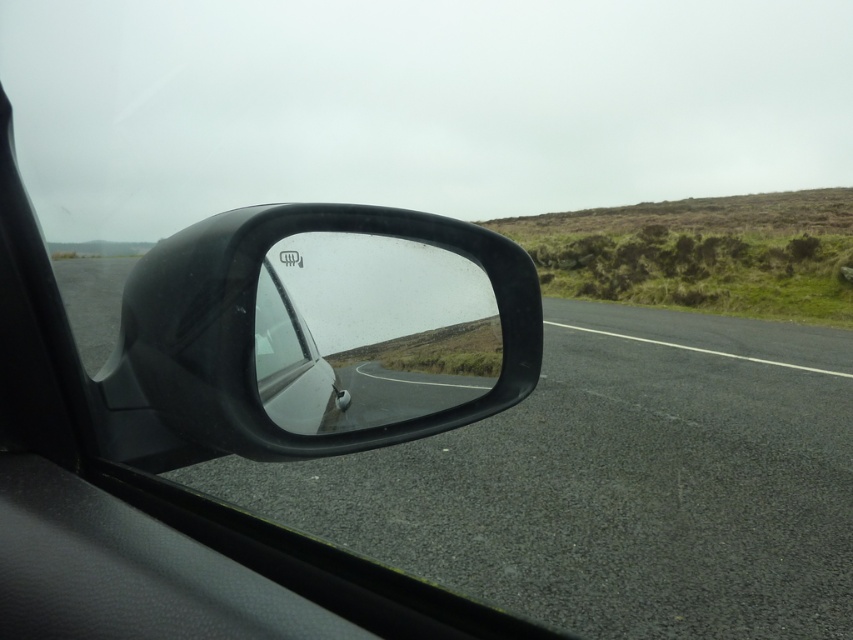
Question: Estimate the real-world distances between objects in this image. Which object is farther from the asphalt road at center?

Choices:
 (A) glossy plastic car mirror at center
 (B) black matte car mirror at center

Answer: (B)

Question: Which point is closer to the camera?

Choices:
 (A) black matte car mirror at center
 (B) glossy plastic car mirror at center
 (C) asphalt road at center

Answer: (A)

Question: Does asphalt road at center have a lesser width compared to black matte car mirror at center?

Choices:
 (A) yes
 (B) no

Answer: (B)

Question: Which is nearer to the black matte car mirror at center?

Choices:
 (A) asphalt road at center
 (B) glossy plastic car mirror at center

Answer: (B)

Question: Observing the image, what is the correct spatial positioning of asphalt road at center in reference to glossy plastic car mirror at center?

Choices:
 (A) above
 (B) below

Answer: (B)

Question: Is black matte car mirror at center closer to the viewer compared to glossy plastic car mirror at center?

Choices:
 (A) no
 (B) yes

Answer: (B)